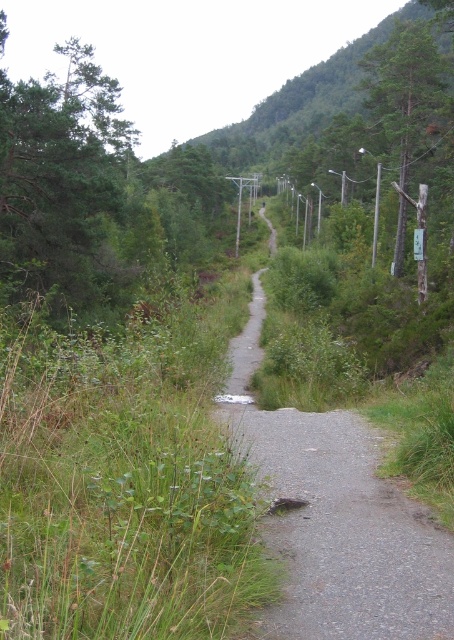
From the picture: You are a hiker trying to navigate the narrow path through the forest. You see the gray gravel path at center and the smooth wooden post at right. Which object is taller?

The smooth wooden post at right is taller than the gray gravel path at center.

You are a hiker who wants to take a photo of the green textured tree at upper left and the green matte tree at upper right. From which side of the path should you stand to capture both trees in the same frame?

You should stand on the left side of the path to capture both the green textured tree at upper left and the green matte tree at upper right in the same frame, as the green textured tree at upper left is positioned to the left of the green matte tree at upper right.

You are a hiker trying to follow the path through the forest. You see the gray gravel path at center and the smooth wooden post at right. Which direction should you go to stay on the path?

The gray gravel path at center is positioned on the left side of the smooth wooden post at right, so to stay on the path, you should head towards the left of the smooth wooden post at right.